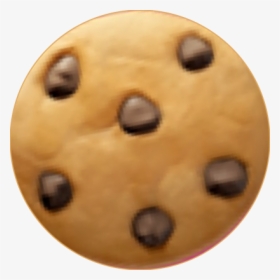
Where is `upper left gray corner`? The width and height of the screenshot is (280, 280). upper left gray corner is located at coordinates (6, 8).